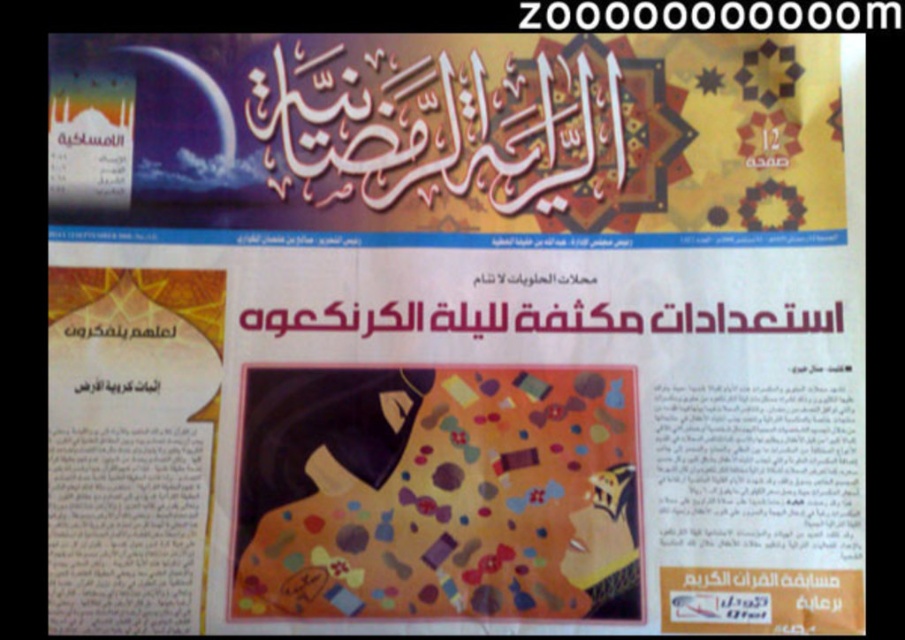
Question: Which point is closer to the camera?

Choices:
 (A) multicolored fabric blanket at center
 (B) black paper at upper center
 (C) matte black text at upper left

Answer: (A)

Question: Which object is positioned farthest from the multicolored fabric blanket at center?

Choices:
 (A) black paper at upper center
 (B) black paper at center

Answer: (A)

Question: Can you confirm if matte black text at upper left is bigger than matte black text at lower left?

Choices:
 (A) yes
 (B) no

Answer: (A)

Question: Estimate the real-world distances between objects in this image. Which object is closer to the black paper at upper center?

Choices:
 (A) matte black text at upper left
 (B) black paper at center

Answer: (B)

Question: Is black paper at center smaller than black paper at upper center?

Choices:
 (A) yes
 (B) no

Answer: (B)

Question: Is black paper at upper center below matte black text at upper left?

Choices:
 (A) no
 (B) yes

Answer: (A)